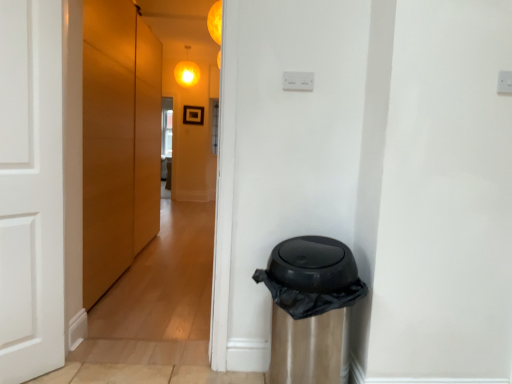
Question: Choose the correct answer: Is matte wood door at left inside orange matte light at upper center, arranged as the 2th light when viewed from the top, or outside it?

Choices:
 (A) outside
 (B) inside

Answer: (A)

Question: From a real-world perspective, relative to orange matte light at upper center, which is the first light in front-to-back order, is matte wood door at left vertically above or below?

Choices:
 (A) below
 (B) above

Answer: (A)

Question: Which is nearer to the matte yellow globe at upper center, the second light in the bottom-to-top sequence?

Choices:
 (A) orange matte light at upper center, placed as the second light when sorted from left to right
 (B) black plastic waste bin at lower right
 (C) matte wood door at left

Answer: (C)

Question: Estimate the real-world distances between objects in this image. Which object is closer to the black plastic waste bin at lower right?

Choices:
 (A) orange matte light at upper center, marked as the first light in a right-to-left arrangement
 (B) matte wood door at left
 (C) matte yellow globe at upper center, which is the second light in right-to-left order

Answer: (A)